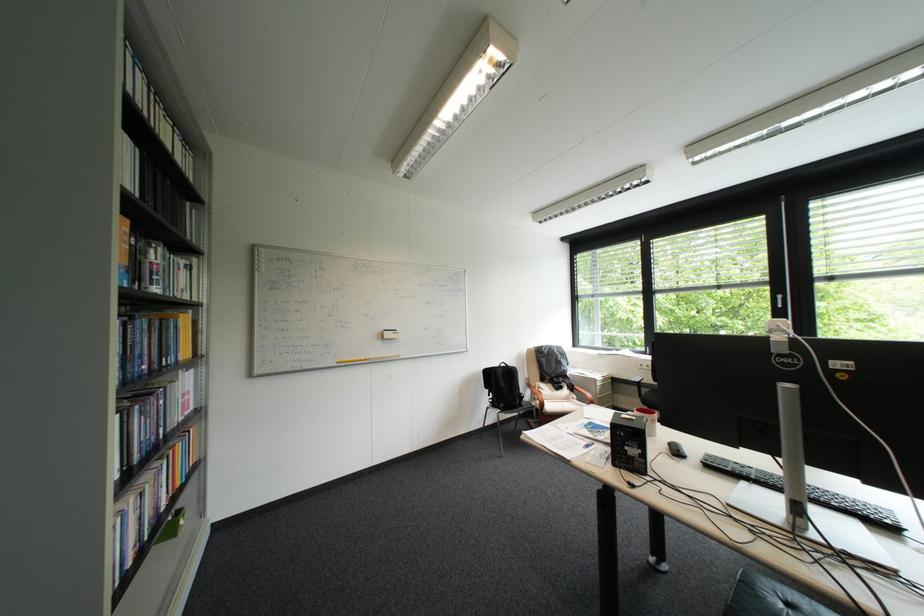
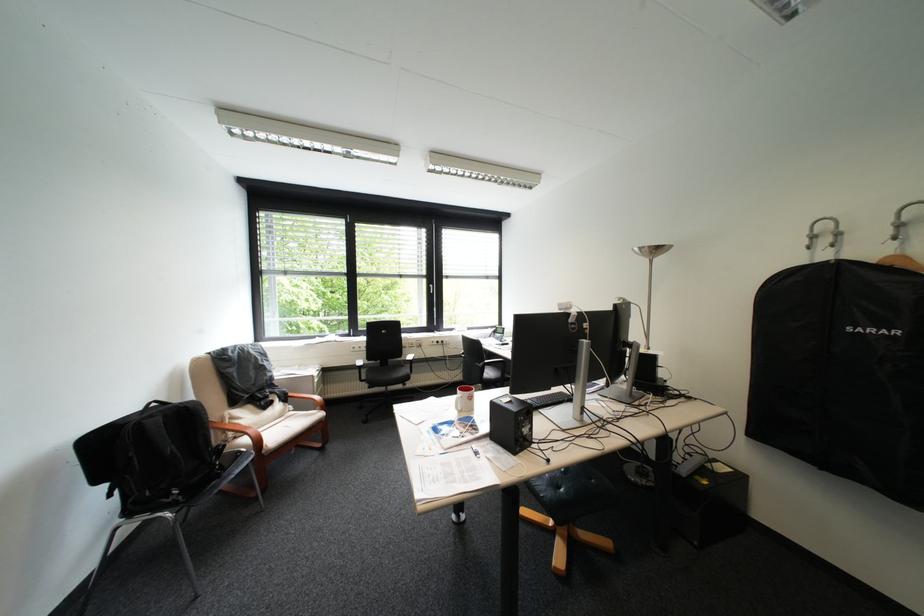
Where in the second image is the point corresponding to (553,406) from the first image?

(271, 443)